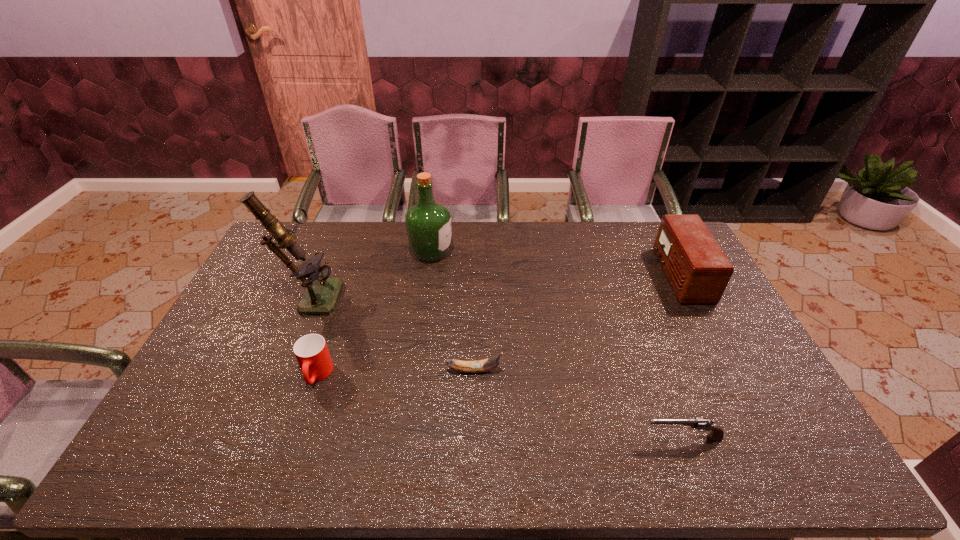
Where is `vacant point located between the fourth shortest object and the cup`? Image resolution: width=960 pixels, height=540 pixels. vacant point located between the fourth shortest object and the cup is located at coordinates (498, 325).

Identify the location of empty location between the cup and the radio receiver. Image resolution: width=960 pixels, height=540 pixels. (498, 325).

You are a GUI agent. You are given a task and a screenshot of the screen. Output one action in this format:
    pyautogui.click(x=<x>, y=<y>)
    Task: Click on the empty location between the third tallest object and the cup
    Image resolution: width=960 pixels, height=540 pixels.
    Given the screenshot: What is the action you would take?
    pyautogui.click(x=498, y=325)

Find the location of a particular element. The image size is (960, 540). vacant space that's between the tallest object and the liquor is located at coordinates (371, 274).

At what (x,y) coordinates should I click in order to perform the action: click on vacant space that's between the third object from right to left and the rightmost object. Please return your answer as a coordinate pair (x, y). Looking at the image, I should click on (577, 322).

At what (x,y) coordinates should I click in order to perform the action: click on blank region between the nearest object and the radio receiver. Please return your answer as a coordinate pair (x, y). Looking at the image, I should click on (682, 356).

Image resolution: width=960 pixels, height=540 pixels. I want to click on free space between the radio receiver and the cup, so click(x=498, y=325).

Where is `object that stands as the second closest to the third shortest object`? object that stands as the second closest to the third shortest object is located at coordinates (490, 363).

What are the coordinates of `object that is the closest one to the radio receiver` in the screenshot? It's located at 717,433.

Where is `blank space that satisfies the following two spatial constraints: 1. on the front-facing side of the rightmost object; 2. on the side of the third shortest object with the handle`? This screenshot has width=960, height=540. blank space that satisfies the following two spatial constraints: 1. on the front-facing side of the rightmost object; 2. on the side of the third shortest object with the handle is located at coordinates (732, 375).